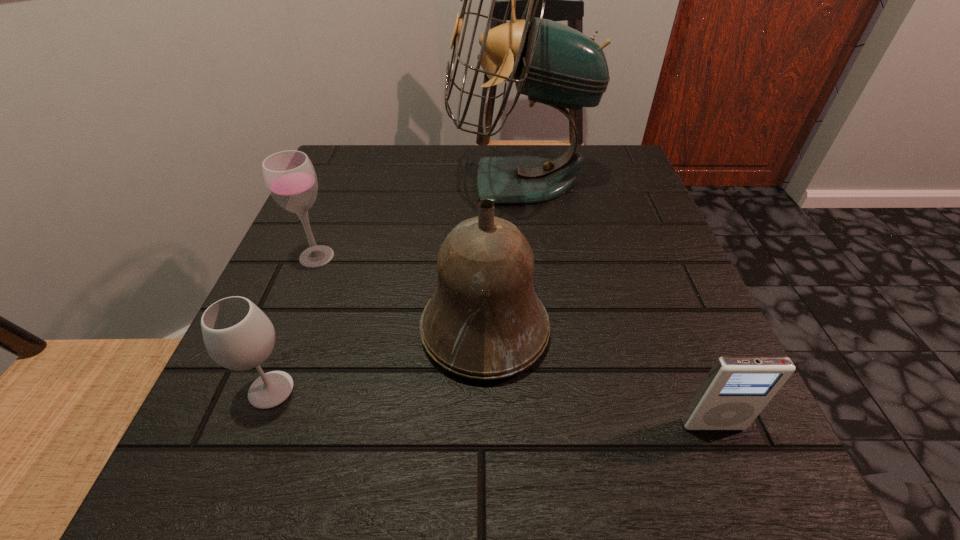
Where is `fan`? fan is located at coordinates (553, 64).

What are the coordinates of `the farthest object` in the screenshot? It's located at (553, 64).

I want to click on the fourth shortest object, so click(x=484, y=321).

You are a GUI agent. You are given a task and a screenshot of the screen. Output one action in this format:
    pyautogui.click(x=<x>, y=<y>)
    Task: Click on the taller wineglass
    The height and width of the screenshot is (540, 960).
    Given the screenshot: What is the action you would take?
    pyautogui.click(x=290, y=177)

The image size is (960, 540). I want to click on the third shortest object, so click(x=290, y=177).

Locate an element on the screen. the shorter wineglass is located at coordinates (238, 335).

The height and width of the screenshot is (540, 960). I want to click on the nearest object, so click(737, 388).

At what (x,y) coordinates should I click in order to perform the action: click on the rightmost object. Please return your answer as a coordinate pair (x, y). This screenshot has width=960, height=540. Looking at the image, I should click on (737, 388).

Where is `free space located 0.160m on the front-facing side of the tallest object for air flow`? Image resolution: width=960 pixels, height=540 pixels. free space located 0.160m on the front-facing side of the tallest object for air flow is located at coordinates (376, 181).

The height and width of the screenshot is (540, 960). I want to click on free space located 0.200m on the front-facing side of the tallest object for air flow, so click(x=359, y=181).